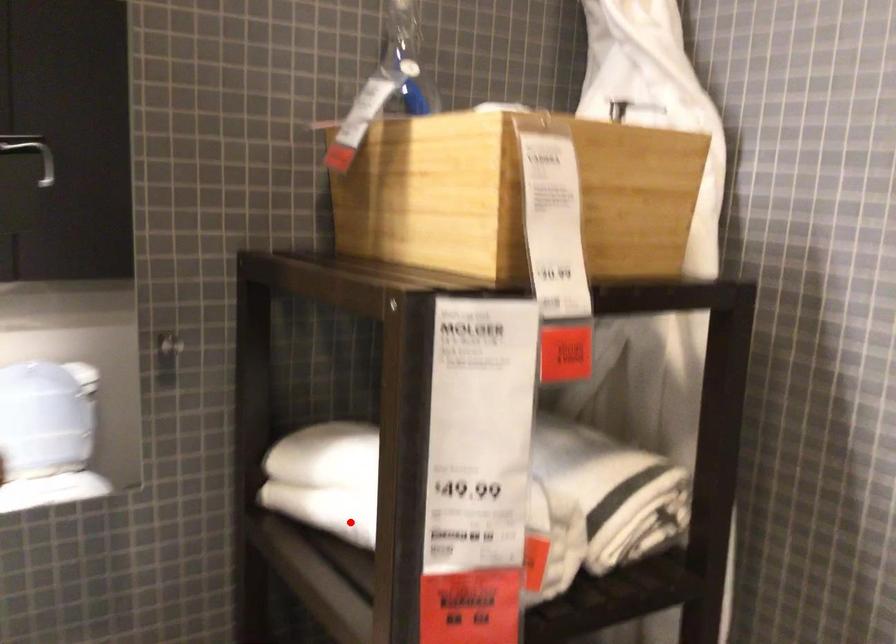
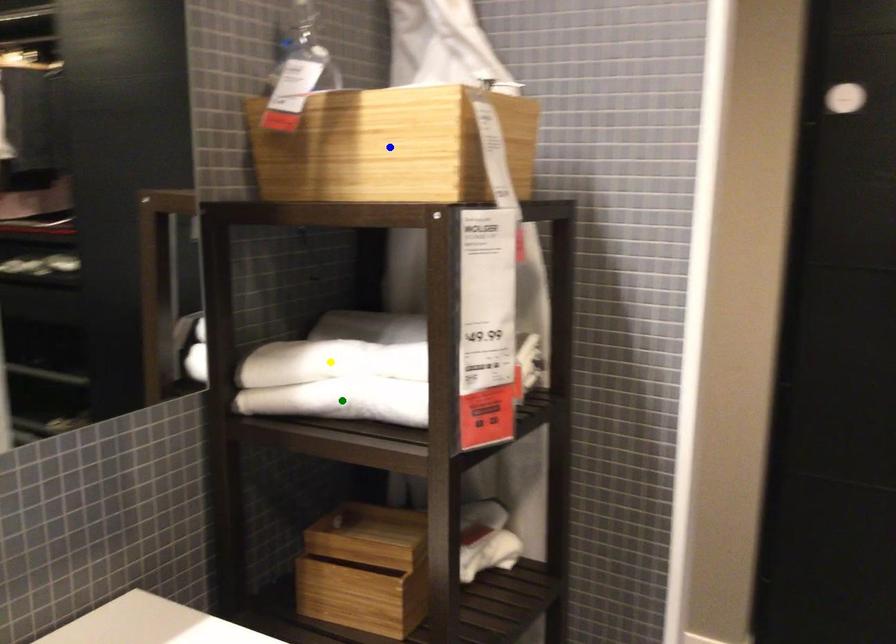
Question: I am providing you with two images of the same scene from different viewpoints. A red point is marked on the first image. You are given multiple points on the second image. Can you choose the point in image 2 that corresponds to the point in image 1?

Choices:
 (A) green point
 (B) blue point
 (C) yellow point

Answer: (A)